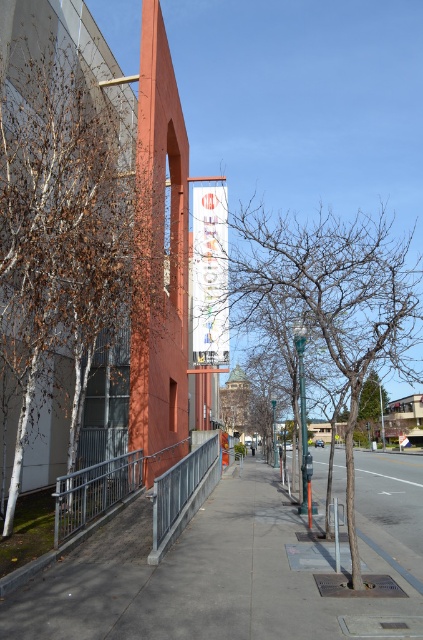
You are standing at the edge of the gray concrete sidewalk at center and want to reach a bench located 5 meters away from you. Can you safely walk to the bench without stepping off the sidewalk?

The gray concrete sidewalk at center and viewer are 4.97 meters apart from each other. Since the bench is 5 meters away, it is slightly beyond the sidewalk, so you may need to step off the sidewalk to reach it.

You are a delivery person carrying a large package that is 1.8 meters wide. You need to navigate through the space between the metallic gray railing at lower left and the silver metallic railing at center. Can your package fit through the space between them?

The space between the metallic gray railing at lower left and the silver metallic railing at center is 1.72 meters. Since the package is 1.8 meters wide, it is wider than the available space. Therefore, the package cannot fit through the space between them.

You are standing at the point marked as point (101, 250). What object is located at that point?

The brown bark tree at left is located at point (101, 250).